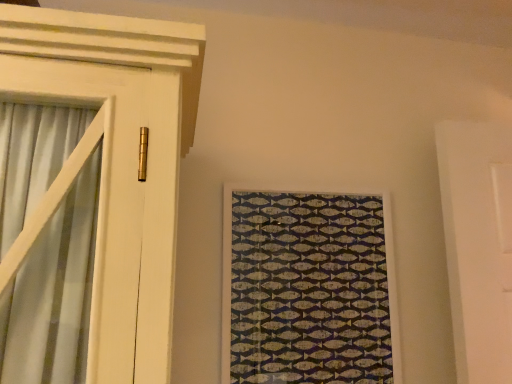
Question: Which direction should I rotate to look at textured fabric fish-patterned artwork at center?

Choices:
 (A) left
 (B) right

Answer: (B)